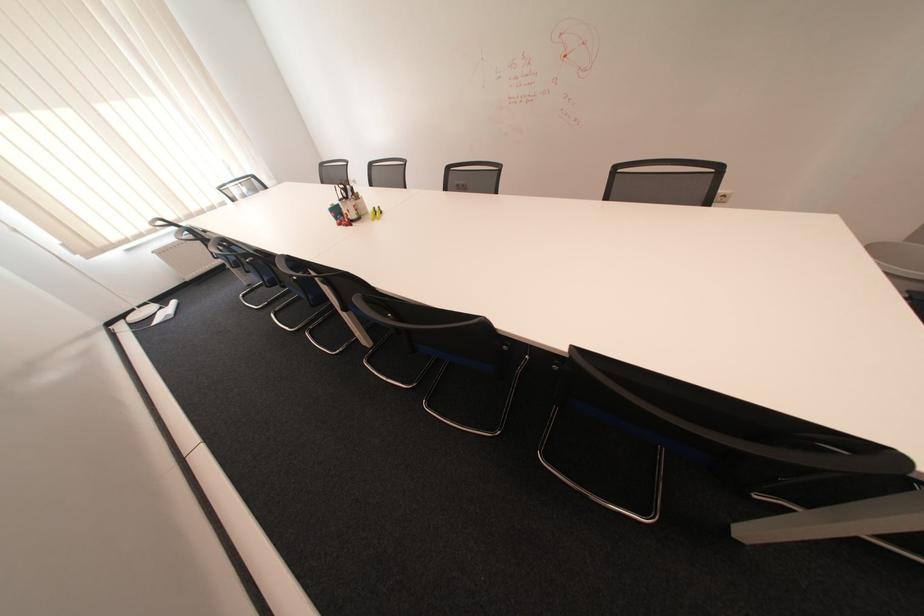
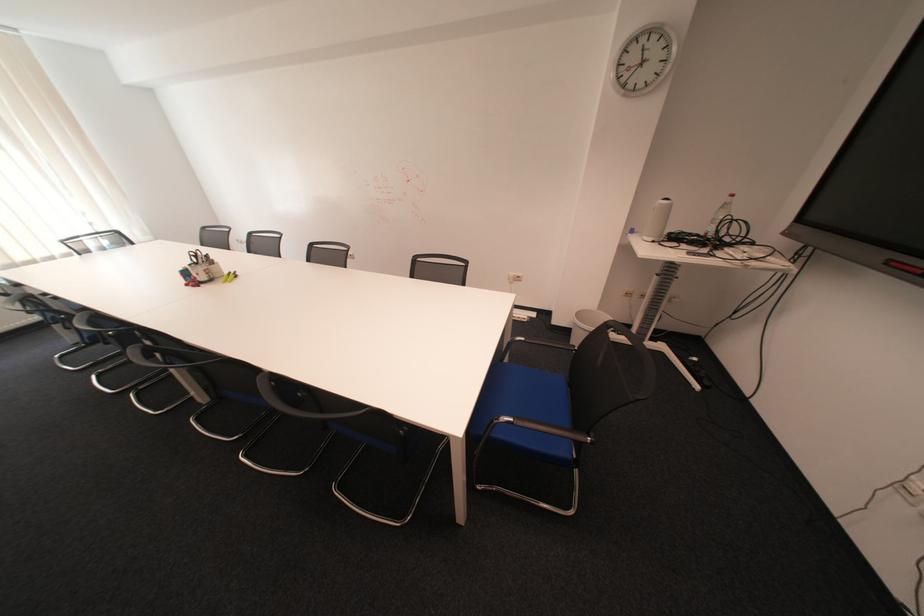
Locate, in the second image, the point that corresponds to (371,219) in the first image.

(223, 281)